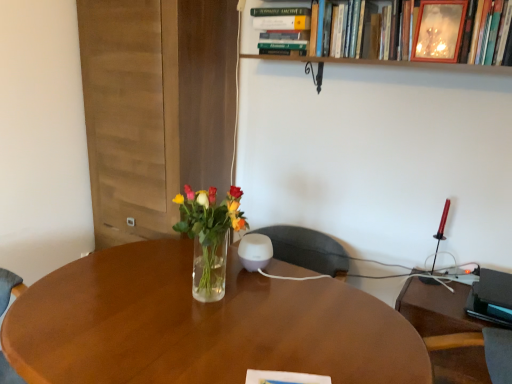
Where is `hardcover book at upper center, acting as the 1th book starting from the left`? The width and height of the screenshot is (512, 384). hardcover book at upper center, acting as the 1th book starting from the left is located at coordinates (282, 30).

Based on the photo, what is the approximate width of wooden frame at upper center, the second book from the left?

It is 7.86 inches.

Find the location of `black plastic computer desk at right`. black plastic computer desk at right is located at coordinates (438, 309).

Where is `translucent glass vase at center`? This screenshot has width=512, height=384. translucent glass vase at center is located at coordinates point(209,236).

Can you confirm if wooden picture frame at upper right is smaller than translucent glass vase at center?

Indeed, wooden picture frame at upper right has a smaller size compared to translucent glass vase at center.

Is point (438, 3) in front of point (199, 233)?

No, (438, 3) is behind (199, 233).

From the image's perspective, does wooden picture frame at upper right appear higher than translucent glass vase at center?

Yes, from the image's perspective, wooden picture frame at upper right is over translucent glass vase at center.

Is wooden picture frame at upper right far from translucent glass vase at center?

Actually, wooden picture frame at upper right and translucent glass vase at center are a little close together.

Is black plastic computer desk at right at the left side of wooden frame at upper center, the first book positioned from the right?

No, black plastic computer desk at right is not to the left of wooden frame at upper center, the first book positioned from the right.

Is black plastic computer desk at right facing away from wooden frame at upper center, the first book positioned from the right?

No, black plastic computer desk at right is not facing the opposite direction of wooden frame at upper center, the first book positioned from the right.

Consider the image. Is wooden frame at upper center, the second book from the left, a part of black plastic computer desk at right?

No, wooden frame at upper center, the second book from the left, is not a part of black plastic computer desk at right.

Does black plastic computer desk at right have a lesser width compared to wooden frame at upper center, the second book from the left?

No, black plastic computer desk at right is not thinner than wooden frame at upper center, the second book from the left.

From the picture: Is black plastic computer desk at right not within hardcover book at upper center, the second book when ordered from right to left?

Yes, black plastic computer desk at right is located beyond the bounds of hardcover book at upper center, the second book when ordered from right to left.

Is black plastic computer desk at right positioned in front of hardcover book at upper center, acting as the 1th book starting from the left?

Yes, it is in front of hardcover book at upper center, acting as the 1th book starting from the left.

Based on the photo, is black plastic computer desk at right turned away from hardcover book at upper center, acting as the 1th book starting from the left?

No, black plastic computer desk at right is not facing the opposite direction of hardcover book at upper center, acting as the 1th book starting from the left.

Is black plastic computer desk at right bigger than hardcover book at upper center, the second book when ordered from right to left?

Indeed, black plastic computer desk at right has a larger size compared to hardcover book at upper center, the second book when ordered from right to left.

Is wooden frame at upper center, the second book from the left, taller than translucent glass vase at center?

No, wooden frame at upper center, the second book from the left, is not taller than translucent glass vase at center.

Can you confirm if wooden frame at upper center, the second book from the left, is bigger than translucent glass vase at center?

Indeed, wooden frame at upper center, the second book from the left, has a larger size compared to translucent glass vase at center.

From the image's perspective, count 1st books upward from the translucent glass vase at center and point to it. Please provide its 2D coordinates.

[(376, 56)]

From the image's perspective, is wooden picture frame at upper right over hardcover book at upper center, acting as the 1th book starting from the left?

No, from the image's perspective, wooden picture frame at upper right is not over hardcover book at upper center, acting as the 1th book starting from the left.

Does wooden picture frame at upper right have a smaller size compared to hardcover book at upper center, the second book when ordered from right to left?

Indeed, wooden picture frame at upper right has a smaller size compared to hardcover book at upper center, the second book when ordered from right to left.

Which is correct: wooden picture frame at upper right is inside hardcover book at upper center, acting as the 1th book starting from the left, or outside of it?

wooden picture frame at upper right is outside hardcover book at upper center, acting as the 1th book starting from the left.

Is point (431, 39) positioned after point (298, 15)?

No, (431, 39) is closer to viewer.

In the scene shown: Which is in front, hardcover book at upper center, acting as the 1th book starting from the left, or wooden frame at upper center, the first book positioned from the right?

wooden frame at upper center, the first book positioned from the right, is in front.

From a real-world perspective, which is physically below, hardcover book at upper center, the second book when ordered from right to left, or wooden frame at upper center, the second book from the left?

hardcover book at upper center, the second book when ordered from right to left, is physically lower.

Is hardcover book at upper center, the second book when ordered from right to left, bigger than wooden frame at upper center, the second book from the left?

Incorrect, hardcover book at upper center, the second book when ordered from right to left, is not larger than wooden frame at upper center, the second book from the left.

Which object is positioned more to the right, hardcover book at upper center, the second book when ordered from right to left, or wooden frame at upper center, the second book from the left?

wooden frame at upper center, the second book from the left, is more to the right.

Would you say black plastic computer desk at right is part of wooden picture frame at upper right's contents?

No, black plastic computer desk at right is not surrounded by wooden picture frame at upper right.

From the image's perspective, who appears lower, wooden picture frame at upper right or black plastic computer desk at right?

From the image's view, black plastic computer desk at right is below.

Is wooden picture frame at upper right thinner than black plastic computer desk at right?

Indeed, wooden picture frame at upper right has a lesser width compared to black plastic computer desk at right.

Looking at this image, which is closer, (439,27) or (424,333)?

Point (439,27) appears to be closer to the viewer than point (424,333).

Locate an element on the screen. This screenshot has width=512, height=384. floral arrangement lying in front of the wooden picture frame at upper right is located at coordinates (209, 236).

Find the location of a particular element. This screenshot has width=512, height=384. computer desk below the wooden frame at upper center, the first book positioned from the right (from a real-world perspective) is located at coordinates (438, 309).

From the image, which object appears to be nearer to hardcover book at upper center, the second book when ordered from right to left, wooden frame at upper center, the first book positioned from the right, or translucent glass vase at center?

Among the two, wooden frame at upper center, the first book positioned from the right, is located nearer to hardcover book at upper center, the second book when ordered from right to left.

Consider the image. Which object lies further to the anchor point wooden frame at upper center, the second book from the left, translucent glass vase at center or black plastic computer desk at right?

black plastic computer desk at right lies further to wooden frame at upper center, the second book from the left, than the other object.

In the scene shown: When comparing their distances from hardcover book at upper center, acting as the 1th book starting from the left, does translucent glass vase at center or black plastic computer desk at right seem closer?

The object closer to hardcover book at upper center, acting as the 1th book starting from the left, is translucent glass vase at center.

When comparing their distances from wooden frame at upper center, the first book positioned from the right, does black plastic computer desk at right or wooden picture frame at upper right seem closer?

The object closer to wooden frame at upper center, the first book positioned from the right, is wooden picture frame at upper right.

From the image, which object appears to be nearer to hardcover book at upper center, acting as the 1th book starting from the left, wooden frame at upper center, the first book positioned from the right, or black plastic computer desk at right?

Based on the image, wooden frame at upper center, the first book positioned from the right, appears to be nearer to hardcover book at upper center, acting as the 1th book starting from the left.

Based on their spatial positions, is wooden frame at upper center, the second book from the left, or wooden picture frame at upper right further from hardcover book at upper center, the second book when ordered from right to left?

Based on the image, wooden picture frame at upper right appears to be further to hardcover book at upper center, the second book when ordered from right to left.

When comparing their distances from hardcover book at upper center, acting as the 1th book starting from the left, does translucent glass vase at center or wooden frame at upper center, the first book positioned from the right, seem closer?

wooden frame at upper center, the first book positioned from the right, is positioned closer to the anchor hardcover book at upper center, acting as the 1th book starting from the left.

When comparing their distances from wooden frame at upper center, the first book positioned from the right, does black plastic computer desk at right or hardcover book at upper center, acting as the 1th book starting from the left, seem further?

The object further to wooden frame at upper center, the first book positioned from the right, is black plastic computer desk at right.

At what (x,y) coordinates should I click in order to perform the action: click on picture frame between hardcover book at upper center, acting as the 1th book starting from the left, and translucent glass vase at center, in the vertical direction. Please return your answer as a coordinate pair (x, y). Image resolution: width=512 pixels, height=384 pixels. Looking at the image, I should click on (439, 30).

Where is `book that lies between hardcover book at upper center, acting as the 1th book starting from the left, and black plastic computer desk at right from top to bottom`? This screenshot has height=384, width=512. book that lies between hardcover book at upper center, acting as the 1th book starting from the left, and black plastic computer desk at right from top to bottom is located at coordinates (376, 56).

Locate an element on the screen. This screenshot has width=512, height=384. floral arrangement between hardcover book at upper center, acting as the 1th book starting from the left, and black plastic computer desk at right in the up-down direction is located at coordinates (209, 236).

The width and height of the screenshot is (512, 384). Identify the location of picture frame that lies between wooden frame at upper center, the second book from the left, and translucent glass vase at center from top to bottom. (439, 30).